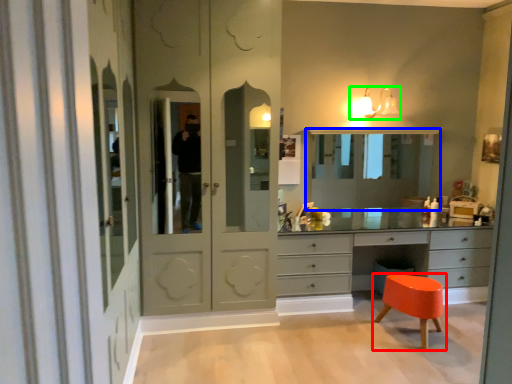
Question: Estimate the real-world distances between objects in this image. Which object is farther from stool (highlighted by a red box), medicine cabinet (highlighted by a blue box) or light fixture (highlighted by a green box)?

Choices:
 (A) medicine cabinet
 (B) light fixture

Answer: (B)